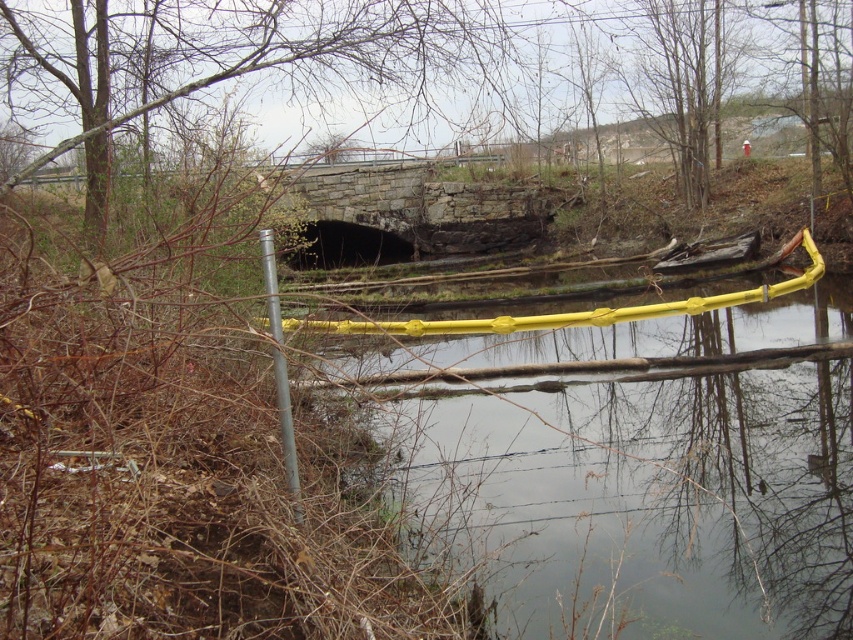
Looking at this image, does yellow rubber barrier at lower center have a lesser height compared to silver metallic pole at left?

Incorrect, yellow rubber barrier at lower center's height does not fall short of silver metallic pole at left's.

Is point (805, 536) positioned behind point (274, 296)?

Yes, it is behind point (274, 296).

You are a GUI agent. You are given a task and a screenshot of the screen. Output one action in this format:
    pyautogui.click(x=<x>, y=<y>)
    Task: Click on the yellow rubber barrier at lower center
    The width and height of the screenshot is (853, 640).
    Given the screenshot: What is the action you would take?
    tap(642, 472)